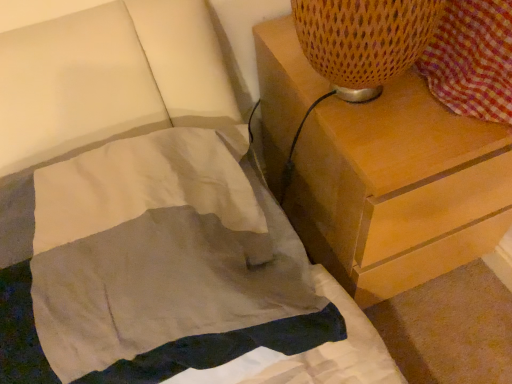
Question: Should I look upward or downward to see light gray cotton blanket at lower left?

Choices:
 (A) down
 (B) up

Answer: (A)

Question: Is the depth of light gray cotton blanket at lower left less than that of wooden chest of drawers at upper right?

Choices:
 (A) no
 (B) yes

Answer: (B)

Question: Would you say light gray cotton blanket at lower left contains wooden chest of drawers at upper right?

Choices:
 (A) no
 (B) yes

Answer: (A)

Question: Is light gray cotton blanket at lower left further to the viewer compared to wooden chest of drawers at upper right?

Choices:
 (A) no
 (B) yes

Answer: (A)

Question: Considering the relative sizes of light gray cotton blanket at lower left and wooden chest of drawers at upper right in the image provided, is light gray cotton blanket at lower left bigger than wooden chest of drawers at upper right?

Choices:
 (A) no
 (B) yes

Answer: (A)

Question: Considering the relative positions of light gray cotton blanket at lower left and wooden chest of drawers at upper right in the image provided, is light gray cotton blanket at lower left to the left of wooden chest of drawers at upper right from the viewer's perspective?

Choices:
 (A) no
 (B) yes

Answer: (B)

Question: Is light gray cotton blanket at lower left thinner than wooden chest of drawers at upper right?

Choices:
 (A) no
 (B) yes

Answer: (B)

Question: Is wooden chest of drawers at upper right closer to the viewer compared to light gray cotton blanket at lower left?

Choices:
 (A) yes
 (B) no

Answer: (B)

Question: Can you confirm if wooden chest of drawers at upper right is positioned to the right of light gray cotton blanket at lower left?

Choices:
 (A) yes
 (B) no

Answer: (A)

Question: Considering the relative sizes of wooden chest of drawers at upper right and light gray cotton blanket at lower left in the image provided, is wooden chest of drawers at upper right wider than light gray cotton blanket at lower left?

Choices:
 (A) no
 (B) yes

Answer: (B)

Question: From the image's perspective, is wooden chest of drawers at upper right located above light gray cotton blanket at lower left?

Choices:
 (A) yes
 (B) no

Answer: (A)

Question: From the image's perspective, is wooden chest of drawers at upper right beneath light gray cotton blanket at lower left?

Choices:
 (A) yes
 (B) no

Answer: (B)

Question: Is wooden chest of drawers at upper right behind light gray cotton blanket at lower left?

Choices:
 (A) no
 (B) yes

Answer: (B)

Question: Relative to wooden chest of drawers at upper right, is light gray cotton blanket at lower left in front or behind?

Choices:
 (A) behind
 (B) front

Answer: (B)